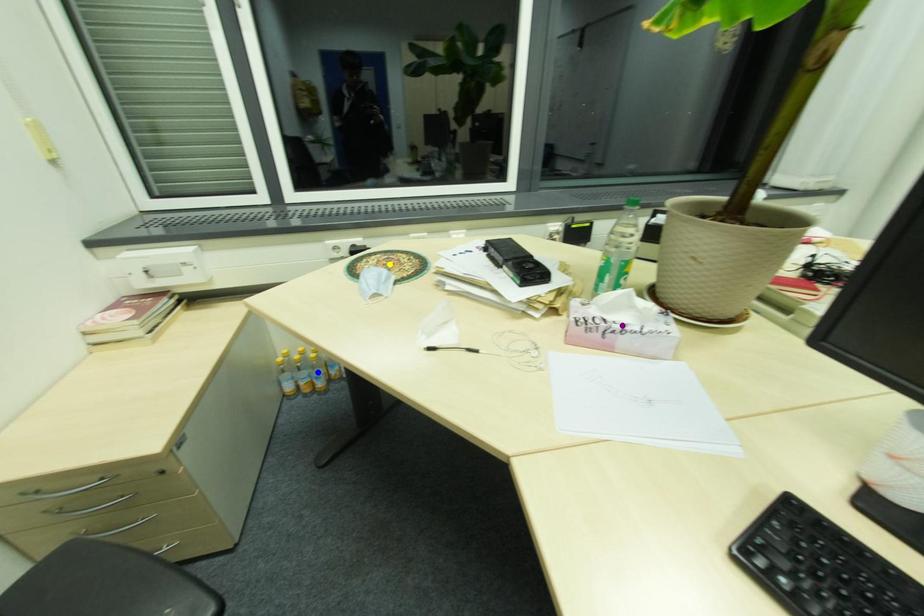
Order these from nearest to farthest:
blue point
yellow point
purple point

1. purple point
2. yellow point
3. blue point